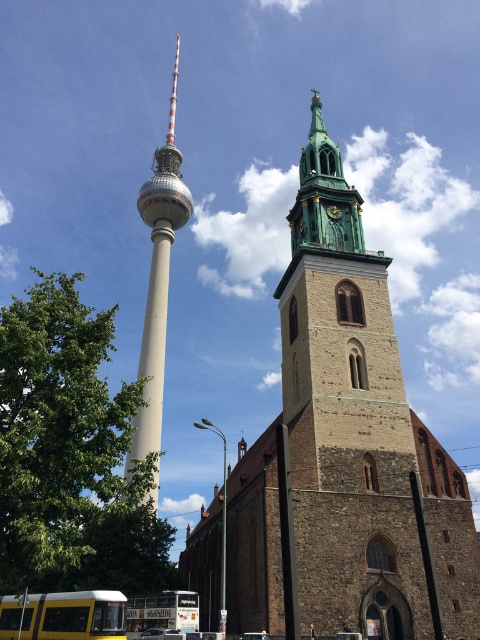
Between brown stone church at center and white concrete spire at center, which one appears on the right side from the viewer's perspective?

brown stone church at center is more to the right.

Does brown stone church at center have a greater height compared to white concrete spire at center?

No.

Between point (314, 477) and point (171, 141), which one is positioned in front?

Positioned in front is point (314, 477).

Find the location of a particular element. This screenshot has width=480, height=640. brown stone church at center is located at coordinates (346, 445).